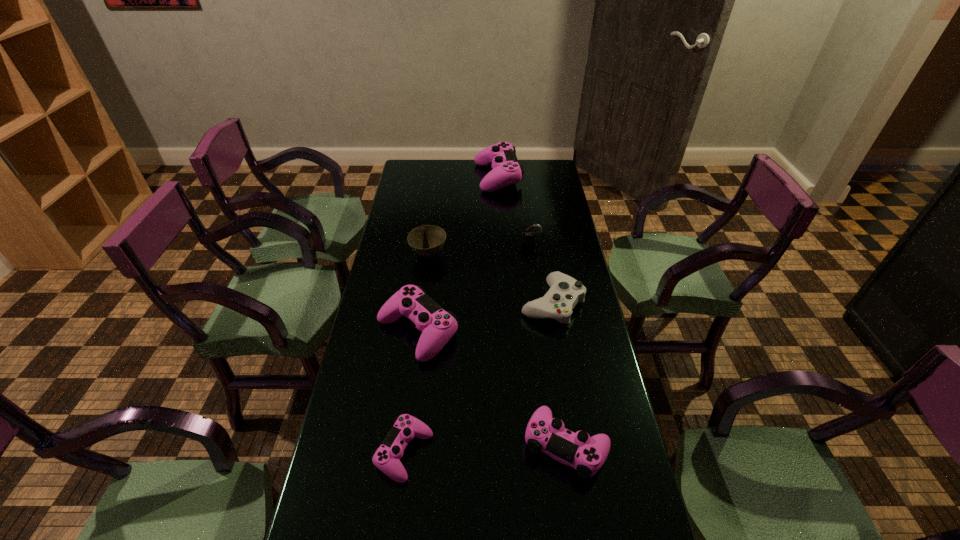
This screenshot has width=960, height=540. I want to click on vacant space located 0.150m on the right of the tallest object, so click(x=553, y=177).

The height and width of the screenshot is (540, 960). What are the coordinates of `vacant point located on the right of the second biggest pink control` in the screenshot? It's located at (571, 331).

Find the location of `vacant region located 0.100m with the keyhole on the front of the padlock`. vacant region located 0.100m with the keyhole on the front of the padlock is located at coordinates (534, 263).

The width and height of the screenshot is (960, 540). I want to click on vacant space situated on the front of the bowl, so click(x=419, y=332).

Identify the location of vacant region located 0.160m on the back of the second smallest pink control. (554, 362).

I want to click on vacant space located on the back of the white control, so click(x=542, y=242).

Where is `vacant region located on the back of the smallest pink control`? This screenshot has height=540, width=960. vacant region located on the back of the smallest pink control is located at coordinates (422, 312).

I want to click on object present at the far edge, so click(506, 170).

Where is `bowl located in the left edge section of the desktop`? This screenshot has height=540, width=960. bowl located in the left edge section of the desktop is located at coordinates (427, 240).

Image resolution: width=960 pixels, height=540 pixels. What are the coordinates of `padlock present at the right edge` in the screenshot? It's located at (528, 238).